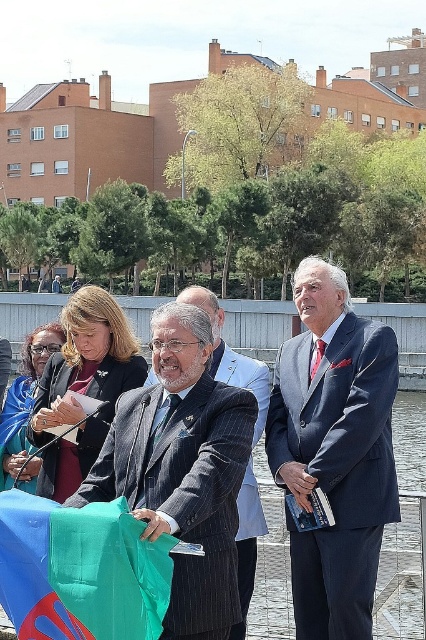
Question: Is matte blue suit at center to the right of pinstriped wool suit at center from the viewer's perspective?

Choices:
 (A) no
 (B) yes

Answer: (B)

Question: Does matte blue suit at center appear on the right side of pinstriped wool suit at center?

Choices:
 (A) yes
 (B) no

Answer: (A)

Question: Among these objects, which one is farthest from the camera?

Choices:
 (A) matte blue suit at center
 (B) green fabric flag at lower left
 (C) pinstriped wool suit at center

Answer: (A)

Question: Estimate the real-world distances between objects in this image. Which object is closer to the striped wool suit at center?

Choices:
 (A) green fabric flag at lower left
 (B) matte blue suit at center
 (C) pinstriped wool suit at center

Answer: (C)

Question: Is matte blue suit at center below green fabric flag at lower left?

Choices:
 (A) no
 (B) yes

Answer: (A)

Question: Estimate the real-world distances between objects in this image. Which object is farther from the green fabric flag at lower left?

Choices:
 (A) matte blue suit at center
 (B) pinstriped wool suit at center

Answer: (A)